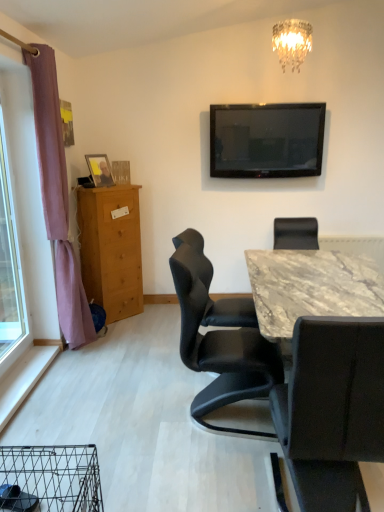
You are a GUI agent. You are given a task and a screenshot of the screen. Output one action in this format:
    pyautogui.click(x=<x>, y=<y>)
    Task: Click on the black leather chair at center, the second chair in the left-to-right sequence
    
    Given the screenshot: What is the action you would take?
    coord(332,410)

Image resolution: width=384 pixels, height=512 pixels. I want to click on transparent glass window at left, so click(10, 269).

This screenshot has height=512, width=384. What do you see at coordinates (99, 169) in the screenshot?
I see `wooden photo frame at left` at bounding box center [99, 169].

Where is `purple fabric curtain at left`? This screenshot has width=384, height=512. purple fabric curtain at left is located at coordinates (57, 198).

From the image's perspective, would you say black leather chair at center, arranged as the second chair when viewed from the right, is shown under purple fabric curtain at left?

Yes.

What's the angular difference between black leather chair at center, arranged as the second chair when viewed from the right, and purple fabric curtain at left's facing directions?

There is a 15.6-degree angle between the facing directions of black leather chair at center, arranged as the second chair when viewed from the right, and purple fabric curtain at left.

Does black leather chair at center, arranged as the second chair when viewed from the right, touch purple fabric curtain at left?

black leather chair at center, arranged as the second chair when viewed from the right, is not next to purple fabric curtain at left, and they're not touching.

From a real-world perspective, is black leather chair at center, arranged as the second chair when viewed from the right, located higher than purple fabric curtain at left?

No, from a real-world perspective, black leather chair at center, arranged as the second chair when viewed from the right, is not over purple fabric curtain at left

Does wooden photo frame at left come behind purple fabric curtain at left?

Yes.

Are wooden photo frame at left and purple fabric curtain at left located far from each other?

wooden photo frame at left is near purple fabric curtain at left, not far away.

Can you confirm if wooden photo frame at left is bigger than purple fabric curtain at left?

No, wooden photo frame at left is not bigger than purple fabric curtain at left.

From the image's perspective, does transparent glass window at left appear higher than purple fabric curtain at left?

No, from the image's perspective, transparent glass window at left is not over purple fabric curtain at left.

Which of these two, transparent glass window at left or purple fabric curtain at left, is thinner?

With smaller width is transparent glass window at left.

Is transparent glass window at left looking in the opposite direction of purple fabric curtain at left?

A: transparent glass window at left does not have its back to purple fabric curtain at left.

Locate an element on the screen. curtain in front of the flat-screen tv at upper center is located at coordinates (57, 198).

Can you confirm if purple fabric curtain at left is thinner than flat-screen tv at upper center?

In fact, purple fabric curtain at left might be wider than flat-screen tv at upper center.

Which is less distant, (51,163) or (247,157)?

Point (51,163) is positioned closer to the camera compared to point (247,157).

From a real-world perspective, which object stands above the other?

wooden photo frame at left, from a real-world perspective.

Is transparent glass window at left at the left side of wooden photo frame at left?

Yes.

Based on the photo, is transparent glass window at left next to wooden photo frame at left?

They are not placed beside each other.

Between transparent glass window at left and wooden photo frame at left, which one has larger size?

transparent glass window at left.

Is the depth of purple fabric curtain at left greater than that of black leather chair at center, which is the 1th chair from left to right?

Yes, purple fabric curtain at left is further from the camera.

Is purple fabric curtain at left not close to black leather chair at center, which is the 1th chair from left to right?

purple fabric curtain at left is positioned a significant distance from black leather chair at center, which is the 1th chair from left to right.

From the image's perspective, between purple fabric curtain at left and black leather chair at center, which is the 1th chair from left to right, who is located below?

black leather chair at center, which is the 1th chair from left to right, is shown below in the image.

Does light brown wooden chest of drawers at left have a lesser width compared to transparent glass window at left?

No.

In the scene shown: Could you tell me if light brown wooden chest of drawers at left is facing transparent glass window at left?

No, light brown wooden chest of drawers at left is not facing towards transparent glass window at left.

From the picture: Considering the sizes of objects light brown wooden chest of drawers at left and transparent glass window at left in the image provided, who is bigger, light brown wooden chest of drawers at left or transparent glass window at left?

light brown wooden chest of drawers at left.

Is light brown wooden chest of drawers at left at the left side of transparent glass window at left?

No.

Which chair is the 1st one when counting from the right side of the purple fabric curtain at left? Please provide its 2D coordinates.

[(219, 343)]

Identify the location of curtain directly beneath the wooden photo frame at left (from a real-world perspective). (57, 198).

Based on their spatial positions, is light brown wooden chest of drawers at left or wooden photo frame at left closer to flat-screen tv at upper center?

The object closer to flat-screen tv at upper center is light brown wooden chest of drawers at left.

From the image, which object appears to be nearer to light brown wooden chest of drawers at left, wooden photo frame at left or black leather chair at center, positioned as the 1th chair in right-to-left order?

Based on the image, wooden photo frame at left appears to be nearer to light brown wooden chest of drawers at left.

Which object lies further to the anchor point flat-screen tv at upper center, transparent glass window at left or black leather chair at center, positioned as the 1th chair in right-to-left order?

black leather chair at center, positioned as the 1th chair in right-to-left order, is further to flat-screen tv at upper center.

Which object lies nearer to the anchor point purple fabric curtain at left, wooden photo frame at left or light brown wooden chest of drawers at left?

light brown wooden chest of drawers at left lies closer to purple fabric curtain at left than the other object.

Looking at the image, which one is located closer to wooden photo frame at left, transparent glass window at left or black leather chair at center, positioned as the 1th chair in right-to-left order?

transparent glass window at left is positioned closer to the anchor wooden photo frame at left.

Estimate the real-world distances between objects in this image. Which object is closer to black leather chair at center, positioned as the 1th chair in right-to-left order, light brown wooden chest of drawers at left or wooden photo frame at left?

light brown wooden chest of drawers at left.

Considering their positions, is transparent glass window at left positioned further to wooden photo frame at left than purple fabric curtain at left?

The object further to wooden photo frame at left is transparent glass window at left.

Which object lies further to the anchor point purple fabric curtain at left, black leather chair at center, the second chair in the left-to-right sequence, or wooden photo frame at left?

Based on the image, black leather chair at center, the second chair in the left-to-right sequence, appears to be further to purple fabric curtain at left.

This screenshot has height=512, width=384. I want to click on curtain positioned between black leather chair at center, the second chair in the left-to-right sequence, and flat-screen tv at upper center from near to far, so click(x=57, y=198).

Identify the location of curtain between transparent glass window at left and black leather chair at center, which is the 1th chair from left to right, in the horizontal direction. (57, 198).

Identify the location of chest of drawers between transparent glass window at left and wooden photo frame at left from front to back. (111, 249).

Locate an element on the screen. This screenshot has width=384, height=512. chair situated between wooden photo frame at left and flat-screen tv at upper center from left to right is located at coordinates (219, 343).